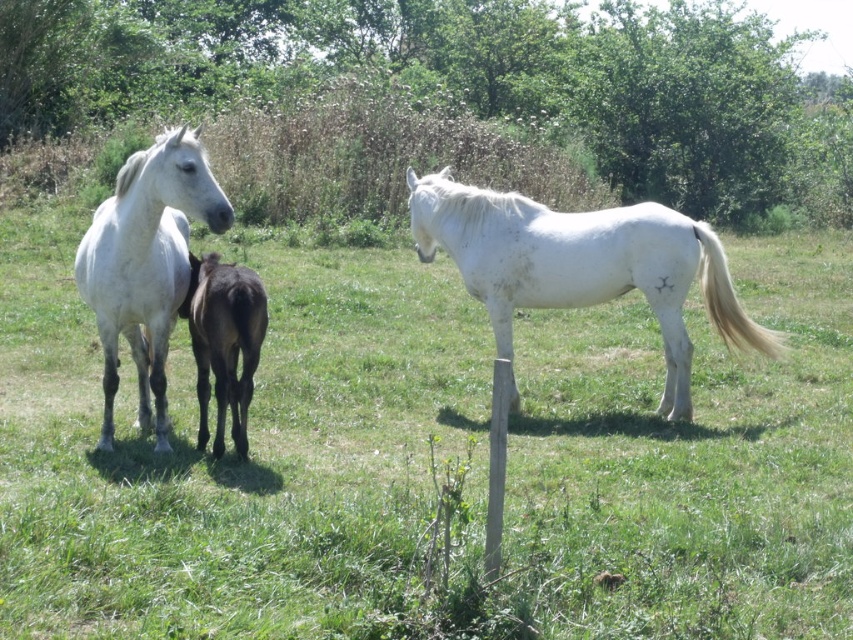
You are standing at the origin point in the image. Where is the white glossy horse at center located in terms of coordinates?

The white glossy horse at center is located at coordinates point (230,449).

Based on the photo, you are a farmer who needs to fit both the white glossy horse at center and the white matte horse at right into a trailer that can only accommodate animals up to the size of the smaller horse. Which horse should you prioritize loading first?

The white glossy horse at center is larger than the white matte horse at right, so you should prioritize loading the white matte horse at right first since it is smaller and fits within the trailer size limit.